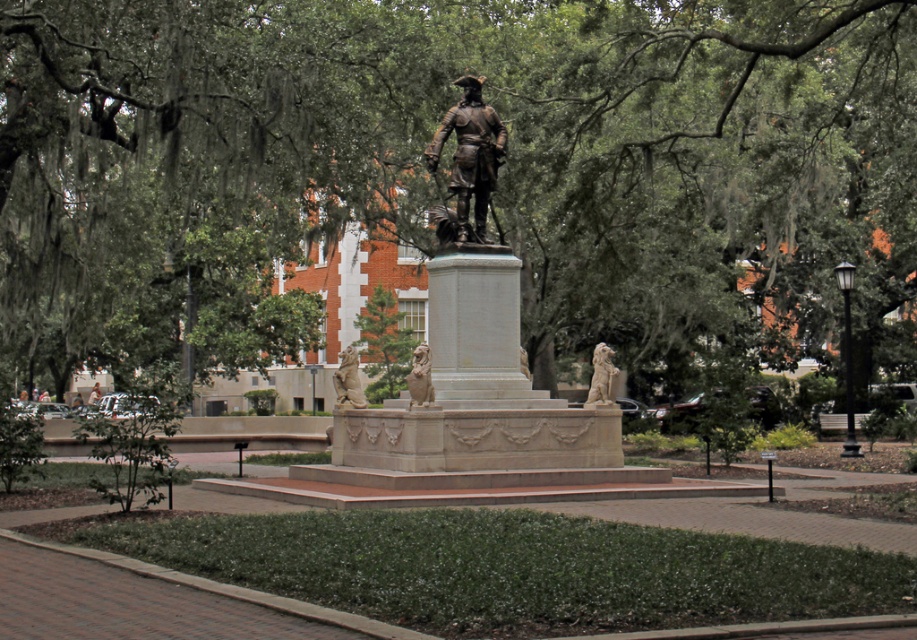
You are a tour guide explaining the statue and its surroundings to visitors. You want to highlight the statue and the lion. Which object is bigger between the shiny bronze statue at center and the golden stone lion at center?

The shiny bronze statue at center is larger in size compared to the golden stone lion at center.